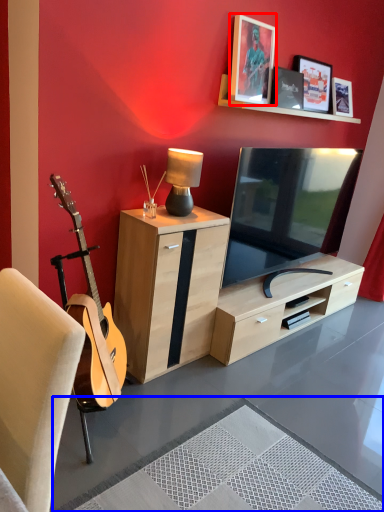
Question: Which object appears closest to the camera in this image, picture frame (highlighted by a red box) or plain (highlighted by a blue box)?

Choices:
 (A) picture frame
 (B) plain

Answer: (B)